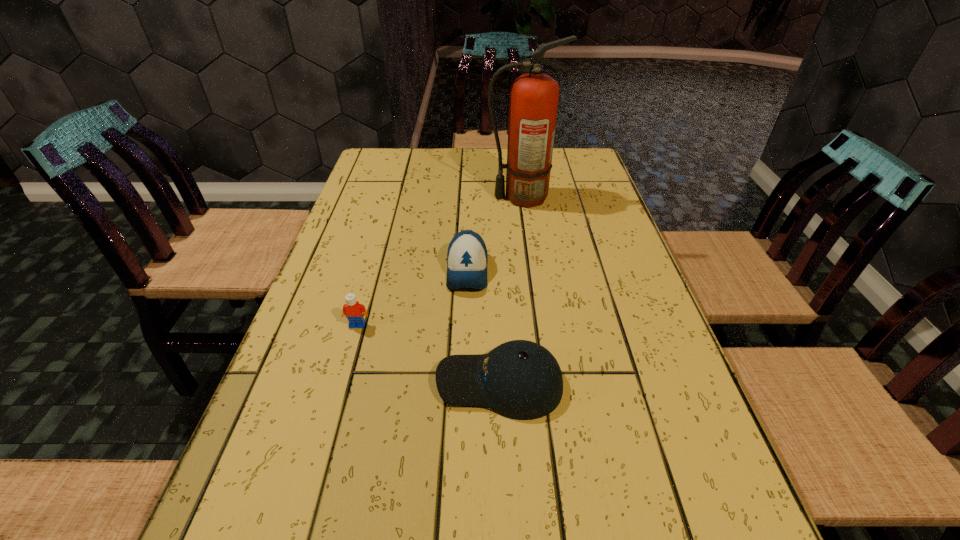
The height and width of the screenshot is (540, 960). I want to click on vacant area between the nearer baseball cap and the farthest object, so click(511, 290).

Locate an element on the screen. The width and height of the screenshot is (960, 540). vacant area that lies between the second nearest object and the farther baseball cap is located at coordinates (412, 298).

This screenshot has width=960, height=540. I want to click on vacant area that lies between the nearer baseball cap and the farther baseball cap, so click(x=484, y=327).

Find the location of a particular element. The height and width of the screenshot is (540, 960). free space that is in between the fire extinguisher and the farther baseball cap is located at coordinates (494, 234).

This screenshot has width=960, height=540. Identify the location of vacant space that is in between the farthest object and the Lego. (440, 261).

This screenshot has width=960, height=540. I want to click on vacant area that lies between the nearest object and the second nearest object, so click(428, 354).

Locate an element on the screen. This screenshot has height=540, width=960. free space between the leftmost object and the farther baseball cap is located at coordinates coord(412,298).

Where is `free spot between the nearer baseball cap and the farthest object`? Image resolution: width=960 pixels, height=540 pixels. free spot between the nearer baseball cap and the farthest object is located at coordinates (511, 290).

You are a GUI agent. You are given a task and a screenshot of the screen. Output one action in this format:
    pyautogui.click(x=<x>, y=<y>)
    Task: Click on the vacant area that lies between the tallest object and the nearer baseball cap
    The height and width of the screenshot is (540, 960).
    Given the screenshot: What is the action you would take?
    pyautogui.click(x=511, y=290)

In order to click on object that stands as the closest to the farthest object in this screenshot , I will do `click(467, 256)`.